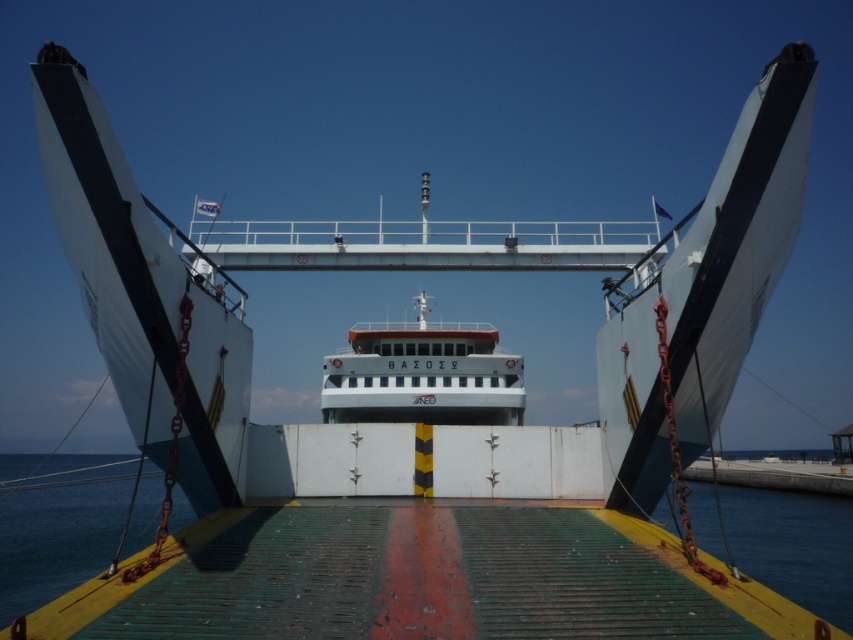
Question: Does white matte ship at center lie behind blue water at lower left?

Choices:
 (A) no
 (B) yes

Answer: (B)

Question: Is white matte ship at center thinner than blue water at lower left?

Choices:
 (A) no
 (B) yes

Answer: (B)

Question: Is white matte ship at center above blue water at lower left?

Choices:
 (A) yes
 (B) no

Answer: (A)

Question: Which of the following is the closest to the observer?

Choices:
 (A) white matte ship at center
 (B) blue water at lower left

Answer: (B)

Question: Which of the following is the farthest from the observer?

Choices:
 (A) (109, 531)
 (B) (520, 392)

Answer: (B)

Question: Which object appears closest to the camera in this image?

Choices:
 (A) blue water at lower left
 (B) white matte ship at center

Answer: (A)